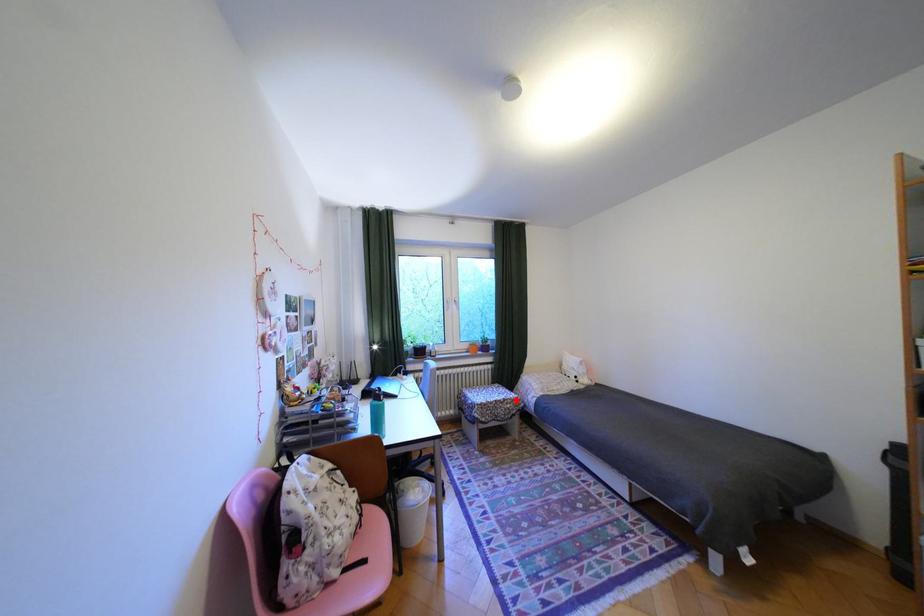
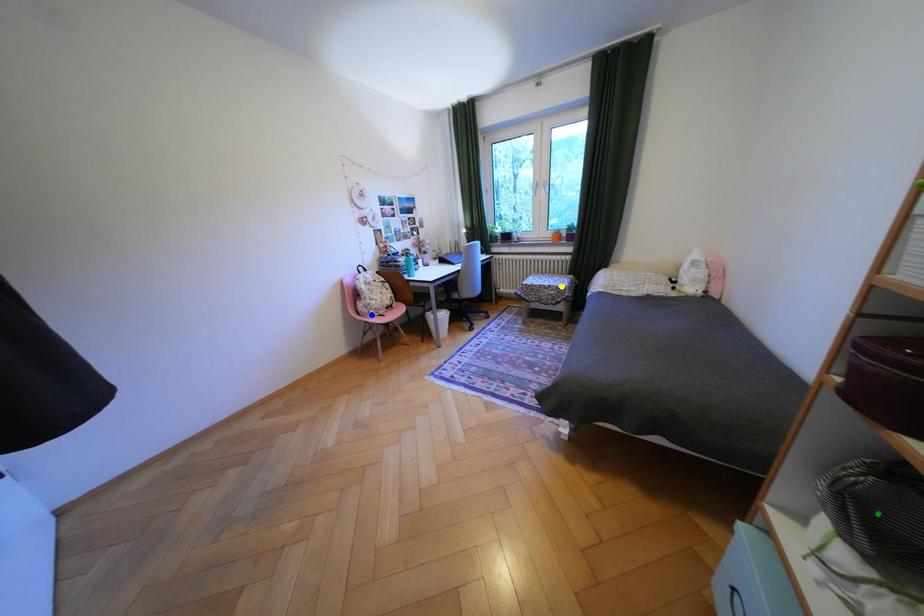
Question: I am providing you with two images of the same scene from different viewpoints. A red point is marked on the first image. You are given multiple points on the second image. Can you choose the point in image 2 that corresponds to the point in image 1?

Choices:
 (A) yellow point
 (B) blue point
 (C) green point

Answer: (A)